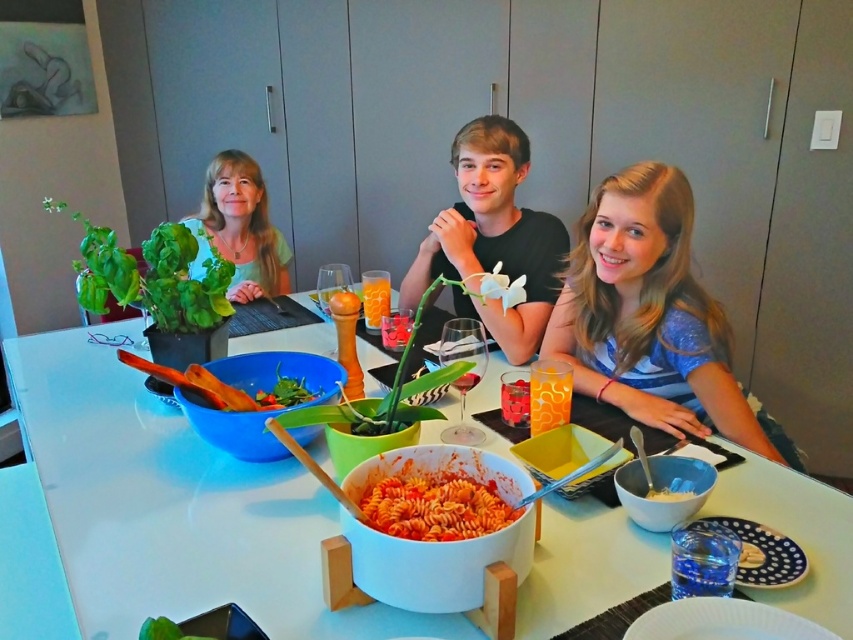
Question: Estimate the real-world distances between objects in this image. Which object is closer to the translucent glass juice at center?

Choices:
 (A) tomato sauce pasta at center
 (B) green matte shirt at upper left
 (C) blue striped shirt at center

Answer: (C)

Question: Does white glossy table at center appear on the left side of translucent glass juice at center?

Choices:
 (A) no
 (B) yes

Answer: (B)

Question: Does blue striped shirt at center appear over black matte shirt at center?

Choices:
 (A) no
 (B) yes

Answer: (A)

Question: Based on their relative distances, which object is nearer to the white matte bowl at center?

Choices:
 (A) translucent glass juice at center
 (B) blue striped shirt at center

Answer: (A)

Question: Is tomato sauce pasta at center to the left of green matte shirt at upper left from the viewer's perspective?

Choices:
 (A) no
 (B) yes

Answer: (A)

Question: Which point is farther to the camera?

Choices:
 (A) white glossy table at center
 (B) green matte shirt at upper left
 (C) black matte shirt at center
 (D) translucent glass juice at center

Answer: (B)